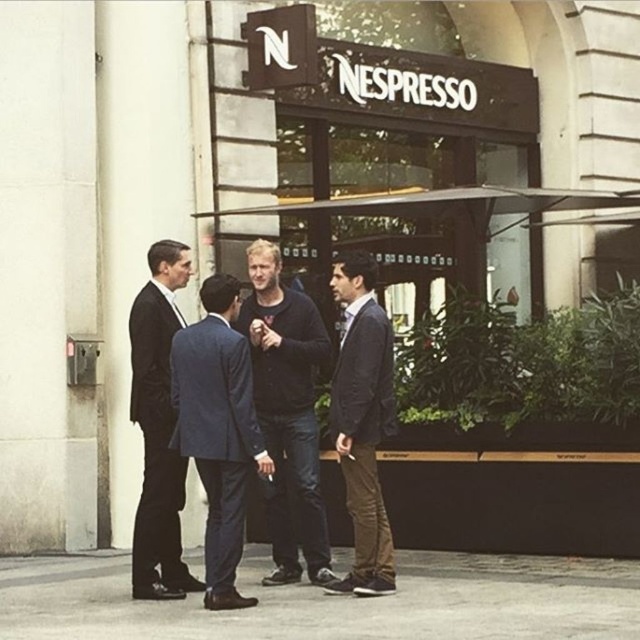
Does dark blue jeans at center have a greater height compared to blue fabric suit at center?

Yes.

Is point (298, 506) positioned behind point (246, 352)?

Yes, it is.

Where is `dark blue jeans at center`? dark blue jeans at center is located at coordinates pyautogui.click(x=288, y=412).

Is point (381, 384) positioned behind point (156, 580)?

No, (381, 384) is in front of (156, 580).

Locate an element on the screen. dark blue suit at center is located at coordinates (362, 420).

Image resolution: width=640 pixels, height=640 pixels. Describe the element at coordinates (218, 429) in the screenshot. I see `blue fabric suit at center` at that location.

Is blue fabric suit at center thinner than dark blue suit at center?

Incorrect, blue fabric suit at center's width is not less than dark blue suit at center's.

Where is `blue fabric suit at center`? blue fabric suit at center is located at coordinates (218, 429).

Locate an element on the screen. This screenshot has width=640, height=640. blue fabric suit at center is located at coordinates (218, 429).